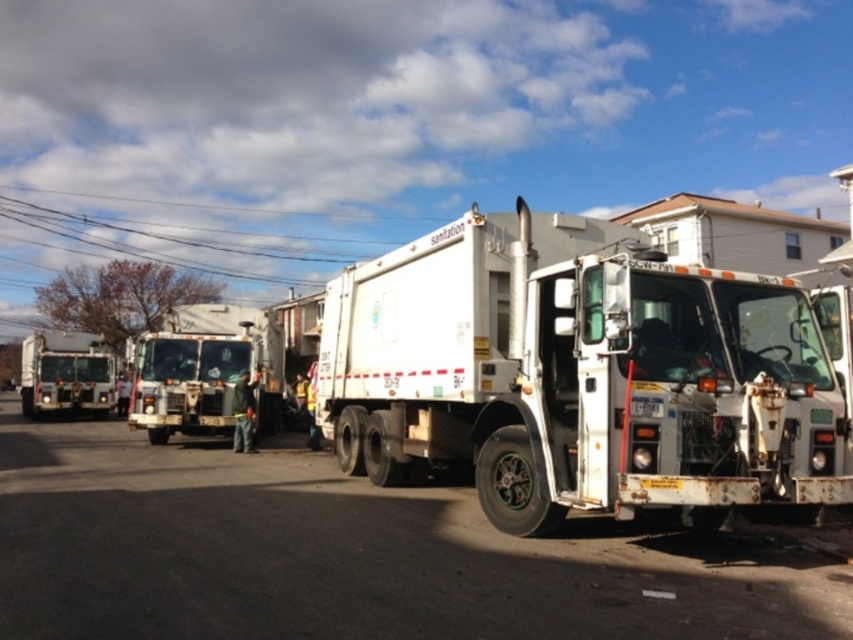
You are a delivery driver who needs to park your van between the white matte garbage truck at center and the white glossy garbage truck at left. The van is 22 feet long. Is there enough space between them to park your van?

The white matte garbage truck at center and white glossy garbage truck at left are 37.46 feet apart, so yes, the van can park between them since the space is larger than the van length.

You are a delivery driver who needs to park your van behind the sanitation trucks. The van is 1.2 meters wider than the white matte sanitation truck at center. Can you park your van behind the white matte garbage truck at center without overlapping?

The white matte sanitation truck at center is smaller than the white matte garbage truck at center. Since your van is wider than the sanitation truck but not necessarily wider than the garbage truck, you need to check the garbage truck width. However, the description only states the sanitation truck is smaller, not the exact dimensions. Therefore, it is uncertain if the van will fit without overlapping.

You are standing at the origin of the coordinate system. You see two points, point (775, 328) and point (82, 412). Which point is closer to you?

Point (775, 328) is in front of point (82, 412), so it is closer to you.